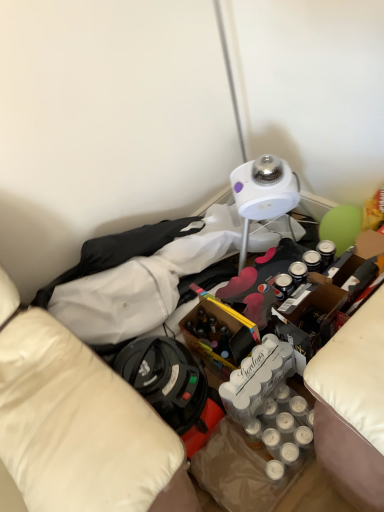
Question: Considering the relative sizes of white smooth shirt at upper left and translucent glass wine bottle at center in the image provided, is white smooth shirt at upper left wider than translucent glass wine bottle at center?

Choices:
 (A) yes
 (B) no

Answer: (B)

Question: Is white smooth shirt at upper left aimed at translucent glass wine bottle at center?

Choices:
 (A) yes
 (B) no

Answer: (A)

Question: From a real-world perspective, is white smooth shirt at upper left physically below translucent glass wine bottle at center?

Choices:
 (A) no
 (B) yes

Answer: (A)

Question: Considering the relative sizes of white smooth shirt at upper left and translucent glass wine bottle at center in the image provided, is white smooth shirt at upper left smaller than translucent glass wine bottle at center?

Choices:
 (A) yes
 (B) no

Answer: (B)

Question: From the image's perspective, is white smooth shirt at upper left located above translucent glass wine bottle at center?

Choices:
 (A) no
 (B) yes

Answer: (B)

Question: From the image's perspective, is white smooth shirt at upper left below translucent glass wine bottle at center?

Choices:
 (A) no
 (B) yes

Answer: (A)

Question: Is the position of translucent glass wine bottle at center more distant than that of white smooth shirt at upper left?

Choices:
 (A) yes
 (B) no

Answer: (B)

Question: Is translucent glass wine bottle at center bigger than white smooth shirt at upper left?

Choices:
 (A) no
 (B) yes

Answer: (A)

Question: Can you confirm if translucent glass wine bottle at center is smaller than white smooth shirt at upper left?

Choices:
 (A) no
 (B) yes

Answer: (B)

Question: From a real-world perspective, is translucent glass wine bottle at center over white smooth shirt at upper left?

Choices:
 (A) no
 (B) yes

Answer: (A)

Question: Is white smooth shirt at upper left surrounded by translucent glass wine bottle at center?

Choices:
 (A) yes
 (B) no

Answer: (B)

Question: Considering the relative positions of translucent glass wine bottle at center and white smooth shirt at upper left in the image provided, is translucent glass wine bottle at center to the right of white smooth shirt at upper left from the viewer's perspective?

Choices:
 (A) yes
 (B) no

Answer: (A)

Question: In terms of width, does translucent glass wine bottle at center look wider or thinner when compared to white smooth shirt at upper left?

Choices:
 (A) thin
 (B) wide

Answer: (B)